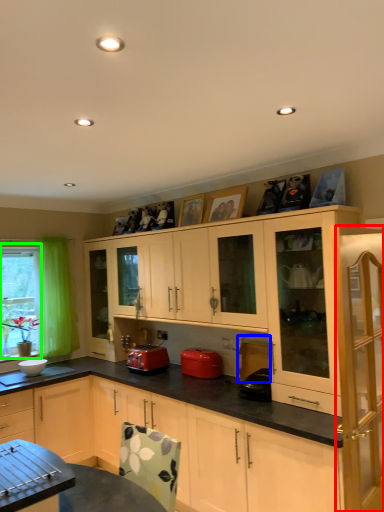
Question: Which is nearer to the cabinetry (highlighted by a red box)? appliance (highlighted by a blue box) or bay window (highlighted by a green box).

Choices:
 (A) appliance
 (B) bay window

Answer: (A)